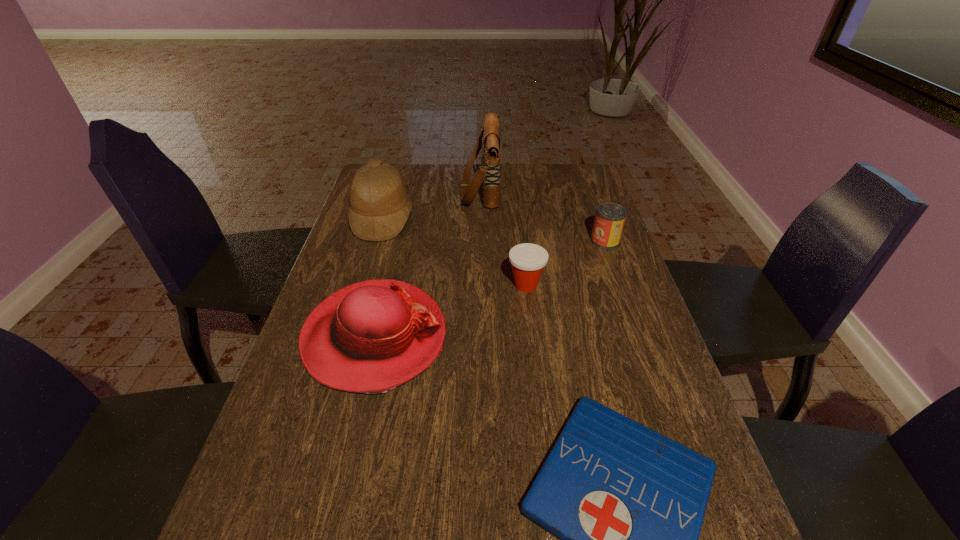
The width and height of the screenshot is (960, 540). Identify the location of shoulder bag. (489, 172).

Identify the location of the farther hat. The image size is (960, 540). click(380, 206).

Find the location of a particular element. the fourth shortest object is located at coordinates (370, 337).

Identify the location of the nearer hat. (370, 337).

This screenshot has width=960, height=540. I want to click on can, so click(x=610, y=217).

Locate an element on the screen. Dixie cup is located at coordinates (528, 260).

At what (x,y) coordinates should I click in order to perform the action: click on free space located 0.050m on the front-facing side of the shoulder bag. Please return your answer as a coordinate pair (x, y). Looking at the image, I should click on (446, 189).

The image size is (960, 540). I want to click on free space located 0.200m on the front-facing side of the shoulder bag, so click(405, 189).

Identify the location of blank space located on the front-facing side of the shoulder bag. The image size is (960, 540). 375,189.

Where is `blank area located 0.360m on the front-facing side of the farther hat`? Image resolution: width=960 pixels, height=540 pixels. blank area located 0.360m on the front-facing side of the farther hat is located at coordinates point(522,219).